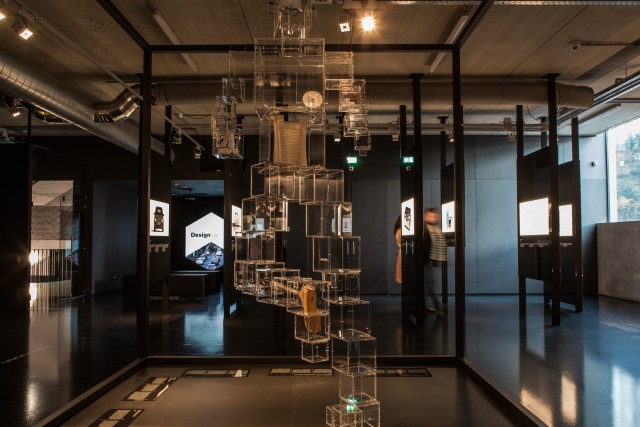
Where is `screen`? This screenshot has height=427, width=640. screen is located at coordinates [564, 218], [534, 217], [445, 222], [404, 218], [346, 220], [235, 225], [256, 225], [205, 237], [157, 215].